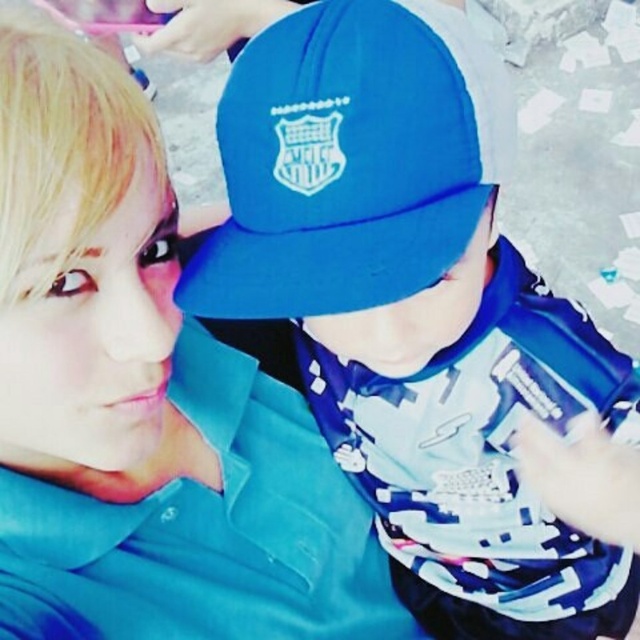
Does matte blue cap at center have a larger size compared to blue matte baseball cap at center?

Indeed, matte blue cap at center has a larger size compared to blue matte baseball cap at center.

Is matte blue cap at center to the right of blue matte baseball cap at center from the viewer's perspective?

Indeed, matte blue cap at center is positioned on the right side of blue matte baseball cap at center.

Who is more distant from viewer, (336,428) or (371,244)?

The point (336,428) is behind.

The height and width of the screenshot is (640, 640). I want to click on matte blue cap at center, so click(x=413, y=307).